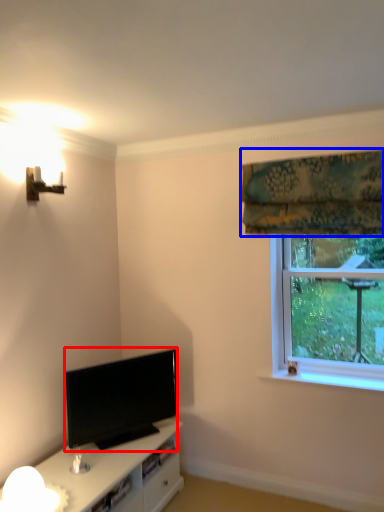
Question: Which object is closer to the camera taking this photo, television (highlighted by a red box) or curtain (highlighted by a blue box)?

Choices:
 (A) television
 (B) curtain

Answer: (B)